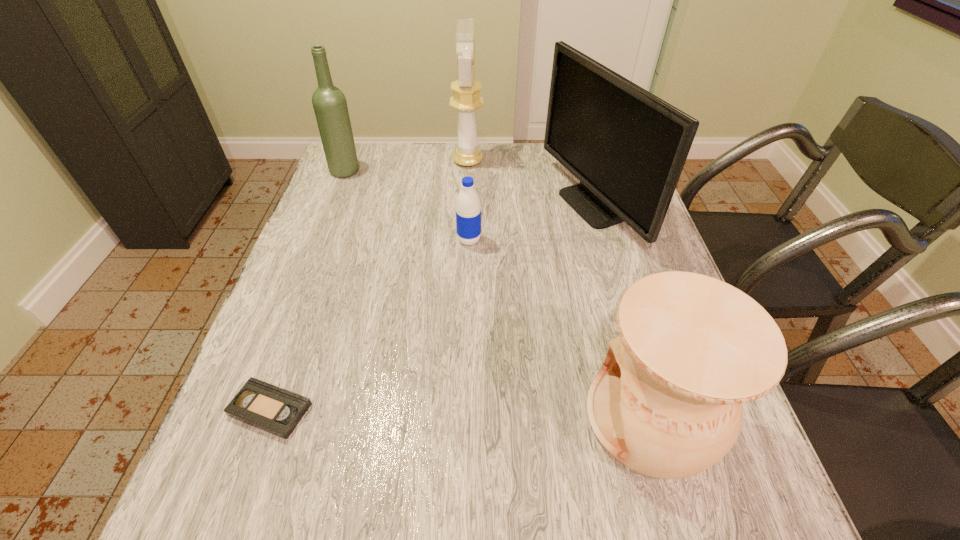
You are a GUI agent. You are given a task and a screenshot of the screen. Output one action in this format:
    pyautogui.click(x=<x>, y=<y>)
    Task: Click on the vacant position located 0.060m on the back of the wine bottle
    This screenshot has height=540, width=960.
    Given the screenshot: What is the action you would take?
    pyautogui.click(x=352, y=153)

Image resolution: width=960 pixels, height=540 pixels. I want to click on free space located at the open side of the fourth tallest object, so click(509, 417).

The height and width of the screenshot is (540, 960). In order to click on blank space located at the open side of the fourth tallest object in this screenshot , I will do `click(531, 417)`.

Where is `blank space located at the open side of the fourth tallest object`? The image size is (960, 540). blank space located at the open side of the fourth tallest object is located at coordinates (381, 417).

What are the coordinates of `free region located on the left of the second shortest object` in the screenshot? It's located at (305, 240).

This screenshot has width=960, height=540. I want to click on vacant space located on the right of the shortest object, so click(420, 409).

The image size is (960, 540). Identify the location of award situated at the far edge. (466, 98).

I want to click on computer monitor at the far edge, so [627, 147].

At what (x,y) coordinates should I click in order to perform the action: click on wine bottle that is positioned at the far edge. Please return your answer as a coordinate pair (x, y). This screenshot has height=540, width=960. Looking at the image, I should click on (330, 106).

At what (x,y) coordinates should I click in order to perform the action: click on object located in the near edge section of the desktop. Please return your answer as a coordinate pair (x, y). Looking at the image, I should click on (667, 403).